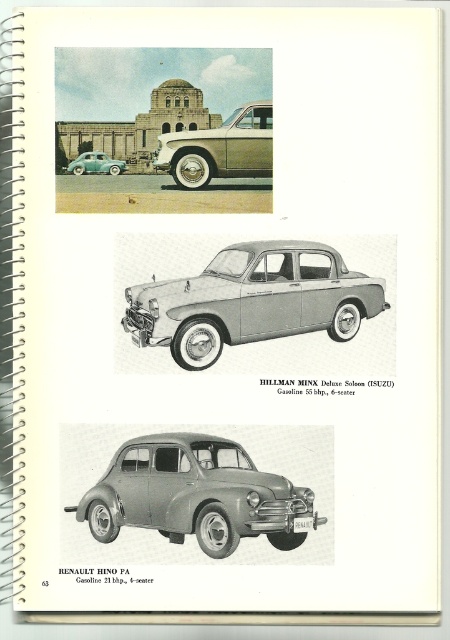
You are a car enthusiast looking at this vintage catalog page. You notice two sedans in the top photograph. Which sedan is closer to you, the matte gray sedan at center or the matte silver sedan at upper center?

The matte gray sedan at center is closer to you because it is positioned in front of the matte silver sedan at upper center.

From the picture: What is located at the coordinates point (x=252, y=300)?

The point (x=252, y=300) marks the silver metallic sedan at center.

You are examining the vintage car catalog and notice two points marked on the photograph of the Hillman Minx Deluxe Saloon. Which point, point (129, 461) or point (95, 150), is closer to you?

Point (129, 461) is closer to the viewer than point (95, 150).